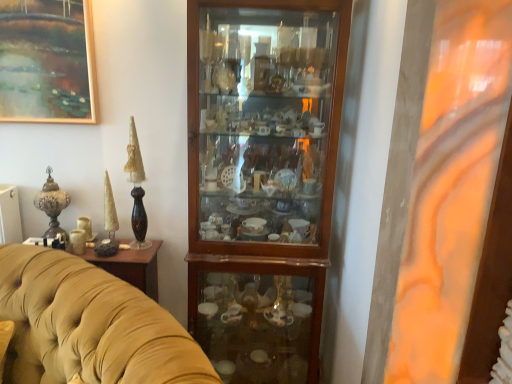
Question: Is the depth of wooden cabinet at center greater than that of polished bronze vase at left?

Choices:
 (A) yes
 (B) no

Answer: (B)

Question: From the image's perspective, is wooden cabinet at center beneath polished bronze vase at left?

Choices:
 (A) no
 (B) yes

Answer: (B)

Question: Is wooden cabinet at center in contact with polished bronze vase at left?

Choices:
 (A) no
 (B) yes

Answer: (A)

Question: Considering the relative sizes of wooden cabinet at center and polished bronze vase at left in the image provided, is wooden cabinet at center wider than polished bronze vase at left?

Choices:
 (A) no
 (B) yes

Answer: (B)

Question: Can you confirm if wooden cabinet at center is taller than polished bronze vase at left?

Choices:
 (A) no
 (B) yes

Answer: (B)

Question: Is wooden cabinet at center smaller than polished bronze vase at left?

Choices:
 (A) yes
 (B) no

Answer: (B)

Question: From the image's perspective, is polished bronze vase at left above velvet yellow couch at center?

Choices:
 (A) yes
 (B) no

Answer: (A)

Question: Is polished bronze vase at left beside velvet yellow couch at center?

Choices:
 (A) yes
 (B) no

Answer: (B)

Question: From a real-world perspective, is polished bronze vase at left under velvet yellow couch at center?

Choices:
 (A) no
 (B) yes

Answer: (A)

Question: Can you confirm if polished bronze vase at left is thinner than velvet yellow couch at center?

Choices:
 (A) no
 (B) yes

Answer: (B)

Question: Is polished bronze vase at left positioned far away from velvet yellow couch at center?

Choices:
 (A) yes
 (B) no

Answer: (B)

Question: Is polished bronze vase at left closer to camera compared to velvet yellow couch at center?

Choices:
 (A) yes
 (B) no

Answer: (B)

Question: Does velvet yellow couch at center appear on the left side of polished bronze vase at left?

Choices:
 (A) no
 (B) yes

Answer: (A)